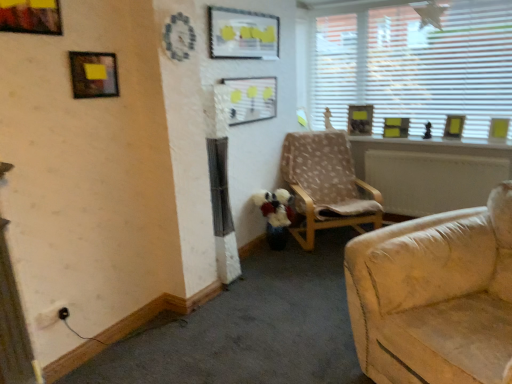
Identify the location of vacant region above matte plastic picture frame at upper center, acting as the third picture frame starting from the front (from a real-world perspective). (233, 6).